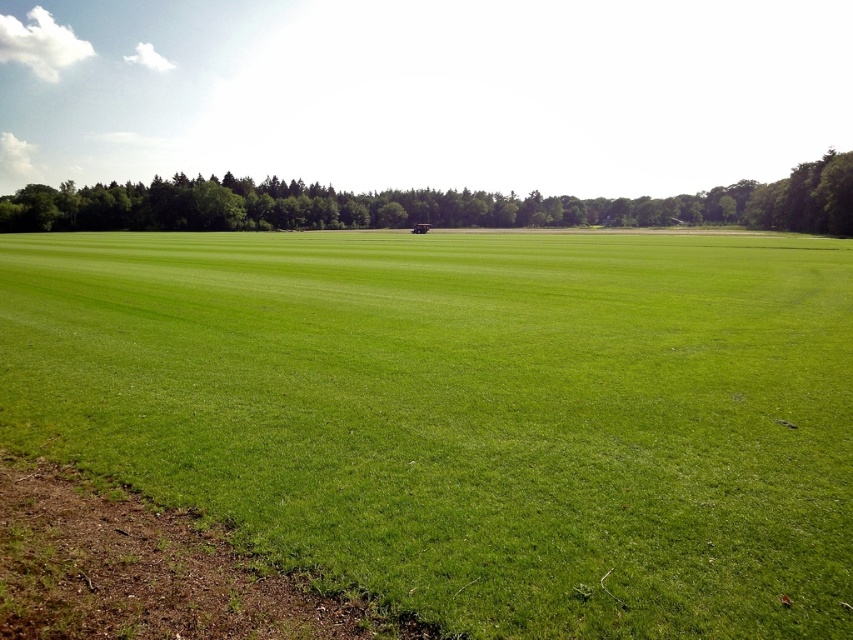
Which of these two, green grass field at center or green grassy field at center, stands taller?

With more height is green grassy field at center.

Which is below, green grass field at center or green grassy field at center?

Positioned lower is green grass field at center.

Locate an element on the screen. Image resolution: width=853 pixels, height=640 pixels. green grass field at center is located at coordinates (468, 413).